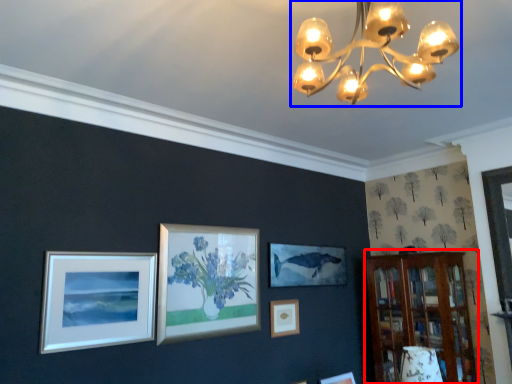
Question: Among these objects, which one is farthest to the camera, bookshelf (highlighted by a red box) or lamp (highlighted by a blue box)?

Choices:
 (A) bookshelf
 (B) lamp

Answer: (A)